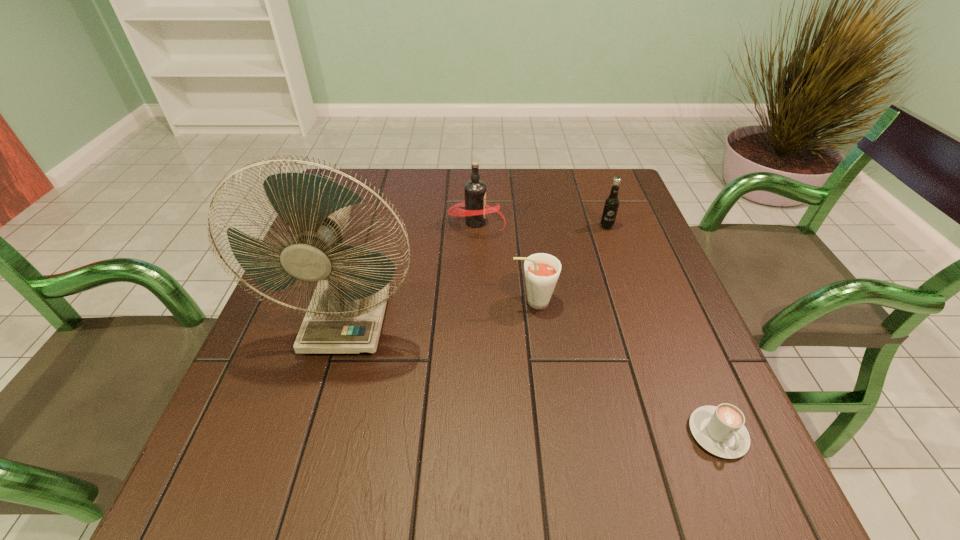
At what (x,y) coordinates should I click in order to perform the action: click on fan. Please return your answer as a coordinate pair (x, y). This screenshot has height=540, width=960. Looking at the image, I should click on (345, 315).

Image resolution: width=960 pixels, height=540 pixels. What are the coordinates of `the tallest object` in the screenshot? It's located at [345, 315].

The height and width of the screenshot is (540, 960). I want to click on the fourth shortest object, so click(x=476, y=209).

Where is `the rightmost root beer`? the rightmost root beer is located at coordinates (611, 204).

Locate an element on the screen. The width and height of the screenshot is (960, 540). the nearest root beer is located at coordinates (541, 270).

This screenshot has height=540, width=960. I want to click on the nearest object, so click(x=720, y=430).

In order to click on cappuccino in this screenshot , I will do `click(720, 430)`.

The height and width of the screenshot is (540, 960). What are the coordinates of `free spot located 0.220m on the front-facing side of the tallest object` in the screenshot? It's located at (304, 469).

In order to click on vacant space located on the label of the fourth shortest object in this screenshot , I will do `click(615, 222)`.

Where is `vacant area located 0.380m on the label of the rightmost root beer`? The height and width of the screenshot is (540, 960). vacant area located 0.380m on the label of the rightmost root beer is located at coordinates 647,343.